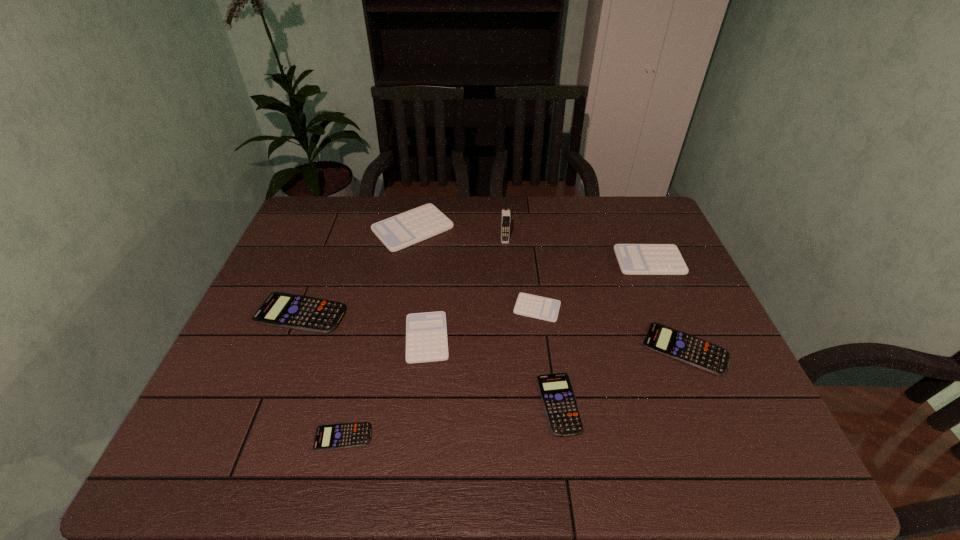
What are the coordinates of `free space between the third smallest blue calculator and the third tallest object` in the screenshot? It's located at (667, 305).

Locate an element on the screen. The height and width of the screenshot is (540, 960). vacant space that is in between the rightmost blue calculator and the biggest white calculator is located at coordinates (549, 288).

The height and width of the screenshot is (540, 960). In order to click on free space between the third white calculator from left to right and the second blue calculator from left to right in this screenshot , I will do `click(440, 373)`.

Locate which object ranks fifth in proximity to the second tallest object. Please provide its 2D coordinates. Your answer should be formatted as a tuple, i.e. [(x, y)], where the tuple contains the x and y coordinates of a point satisfying the conditions above.

[(562, 412)]

At what (x,y) coordinates should I click in order to perform the action: click on object that is the fourth nearest to the second smallest white calculator. Please return your answer as a coordinate pair (x, y). Looking at the image, I should click on (562, 412).

The width and height of the screenshot is (960, 540). What are the coordinates of `calculator that stands as the fourth closest to the leftmost blue calculator` in the screenshot? It's located at (533, 306).

This screenshot has width=960, height=540. What are the coordinates of `the seventh closest calculator relative to the second biggest white calculator` in the screenshot? It's located at (357, 434).

The image size is (960, 540). Find the location of `white calculator that can be found as the third closest to the third blue calculator from left to right`. white calculator that can be found as the third closest to the third blue calculator from left to right is located at coordinates (634, 259).

Where is `white calculator identified as the third closest to the second tallest calculator`? white calculator identified as the third closest to the second tallest calculator is located at coordinates (426, 333).

Find the location of `blue calculator that stands as the second closest to the second blue calculator from left to right`. blue calculator that stands as the second closest to the second blue calculator from left to right is located at coordinates (562, 412).